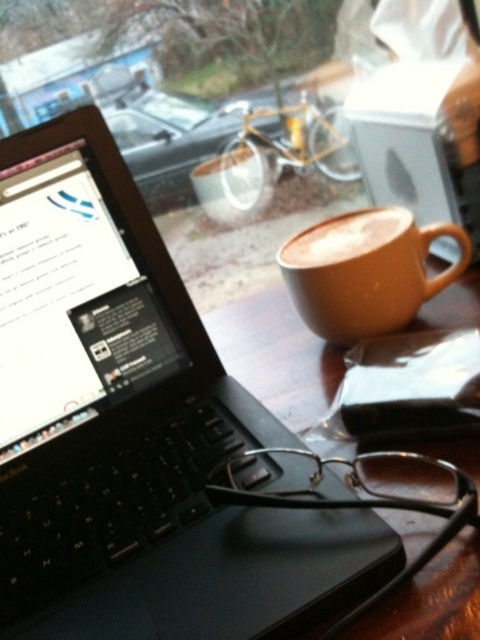
You are sitting at the wooden table at center and want to reach the matte brown mug at center. Is the mug within your immediate reach without moving your chair?

The wooden table at center is in front of the matte brown mug at center, so the mug is likely within immediate reach if you can extend your arm forward.

You have a small snack box that is 15 cm wide. You want to place it on the wooden table at center without overlapping the brown matte cup at center. Is there enough space?

The wooden table at center is bigger than the brown matte cup at center, so there should be enough space to place the snack box without overlapping the cup.

You are sitting at the wooden table at center and want to reach the matte brown mug at center without moving your chair. Can you easily reach it while keeping your back straight?

The wooden table at center is located below matte brown mug at center, so the mug is placed on the table. Since the table is at a standard height for sitting, you can easily reach the matte brown mug at center without moving your chair while keeping your back straight.